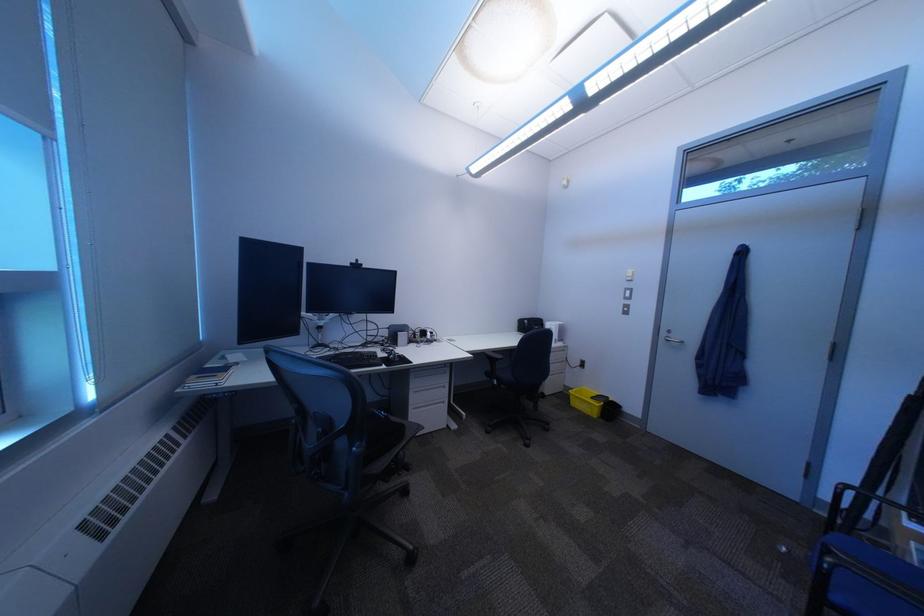
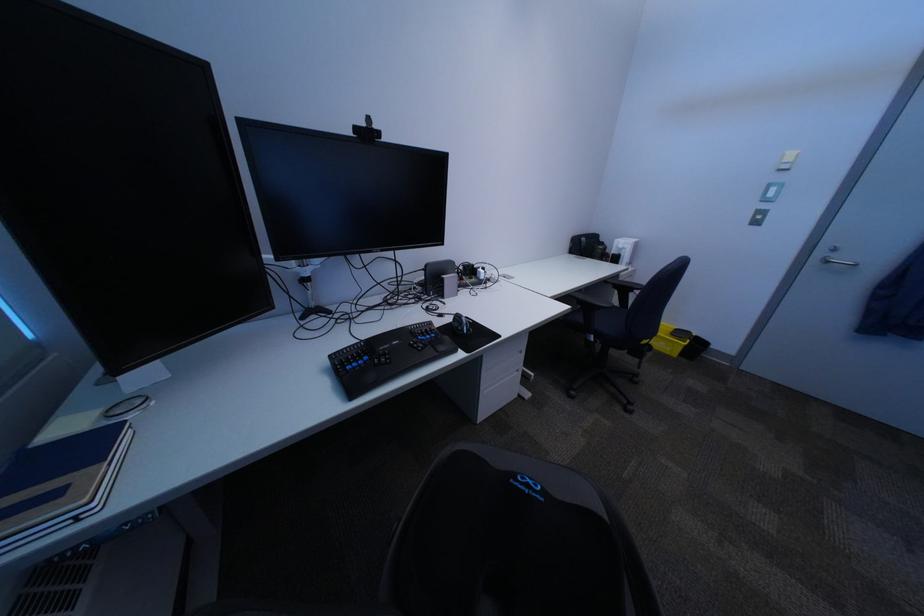
Where in the second image is the point corresponding to pixel 367 265 from the first image?

(371, 131)